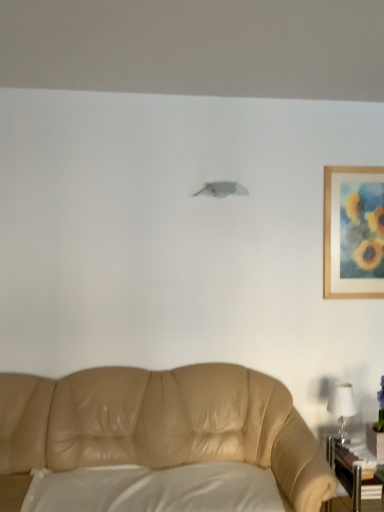
Question: Is white matte pillow at lower center oriented away from white glossy table lamp at right?

Choices:
 (A) no
 (B) yes

Answer: (A)

Question: Is white matte pillow at lower center facing towards white glossy table lamp at right?

Choices:
 (A) no
 (B) yes

Answer: (A)

Question: From a real-world perspective, is white matte pillow at lower center beneath white glossy table lamp at right?

Choices:
 (A) no
 (B) yes

Answer: (B)

Question: Is white matte pillow at lower center at the right side of white glossy table lamp at right?

Choices:
 (A) yes
 (B) no

Answer: (B)

Question: From the image's perspective, is white matte pillow at lower center on top of white glossy table lamp at right?

Choices:
 (A) no
 (B) yes

Answer: (A)

Question: Is metallic silver table at lower right in front of or behind white matte lampshade at upper center in the image?

Choices:
 (A) front
 (B) behind

Answer: (A)

Question: Considering the positions of metallic silver table at lower right and white matte lampshade at upper center in the image, is metallic silver table at lower right bigger or smaller than white matte lampshade at upper center?

Choices:
 (A) small
 (B) big

Answer: (B)

Question: From their relative heights in the image, would you say metallic silver table at lower right is taller or shorter than white matte lampshade at upper center?

Choices:
 (A) short
 (B) tall

Answer: (B)

Question: From the image's perspective, relative to white matte lampshade at upper center, is metallic silver table at lower right above or below?

Choices:
 (A) below
 (B) above

Answer: (A)

Question: Relative to wooden framed painting at upper right, is white matte lampshade at upper center in front or behind?

Choices:
 (A) behind
 (B) front

Answer: (B)

Question: Looking at their shapes, would you say white matte lampshade at upper center is wider or thinner than wooden framed painting at upper right?

Choices:
 (A) wide
 (B) thin

Answer: (A)

Question: Is point (206, 186) positioned closer to the camera than point (365, 289)?

Choices:
 (A) farther
 (B) closer

Answer: (B)

Question: In the image, is white matte lampshade at upper center on the left side or the right side of wooden framed painting at upper right?

Choices:
 (A) right
 (B) left

Answer: (B)

Question: Looking at the image, does white glossy table lamp at right seem bigger or smaller compared to metallic silver table at lower right?

Choices:
 (A) small
 (B) big

Answer: (A)

Question: In terms of width, does white glossy table lamp at right look wider or thinner when compared to metallic silver table at lower right?

Choices:
 (A) thin
 (B) wide

Answer: (A)